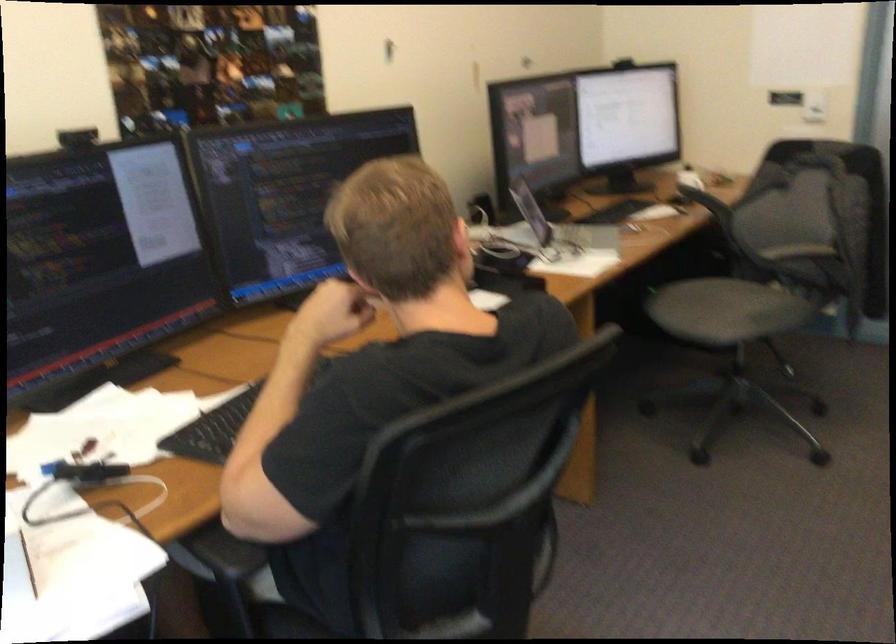
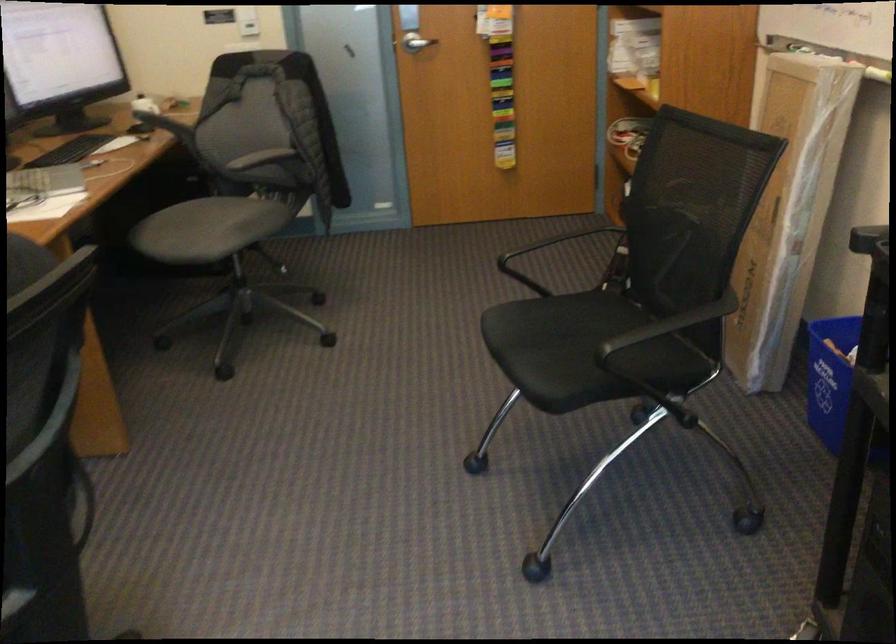
Locate, in the second image, the point that corresponds to pixel 700 192 in the first image.

(158, 120)